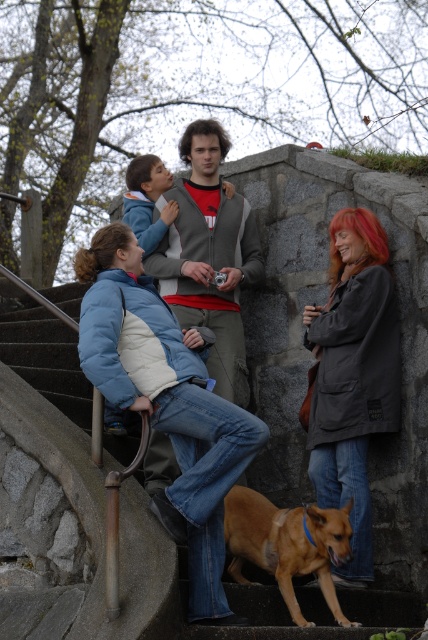
Question: Which of the following is the closest to the observer?

Choices:
 (A) brown furry dog at lower center
 (B) blue denim jacket at left
 (C) gray fleece jacket at center
 (D) matte gray coat at center

Answer: (B)

Question: Is gray fleece jacket at center in front of brown furry dog at lower center?

Choices:
 (A) no
 (B) yes

Answer: (A)

Question: Which point appears farthest from the camera in this image?

Choices:
 (A) (288, 604)
 (B) (246, 284)

Answer: (B)

Question: Based on their relative distances, which object is farther from the gray fleece jacket at center?

Choices:
 (A) brown furry dog at lower center
 (B) blue denim jacket at left
 (C) matte gray coat at center

Answer: (A)

Question: Can you confirm if blue denim jacket at left is positioned to the right of brown furry dog at lower center?

Choices:
 (A) yes
 (B) no

Answer: (B)

Question: Is matte gray coat at center above gray fleece jacket at center?

Choices:
 (A) no
 (B) yes

Answer: (A)